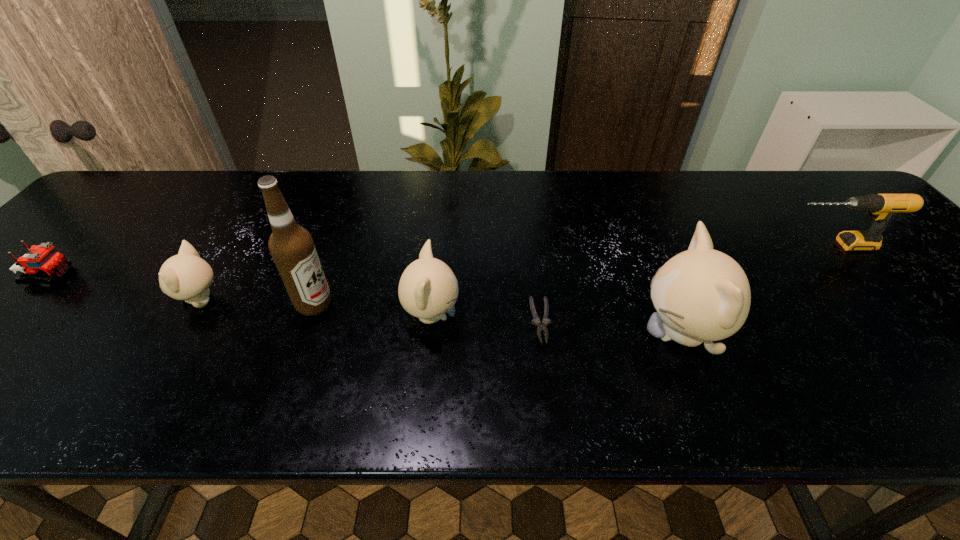
The image size is (960, 540). What are the coordinates of `vacant spot to place a kitten on the right` in the screenshot? It's located at (948, 353).